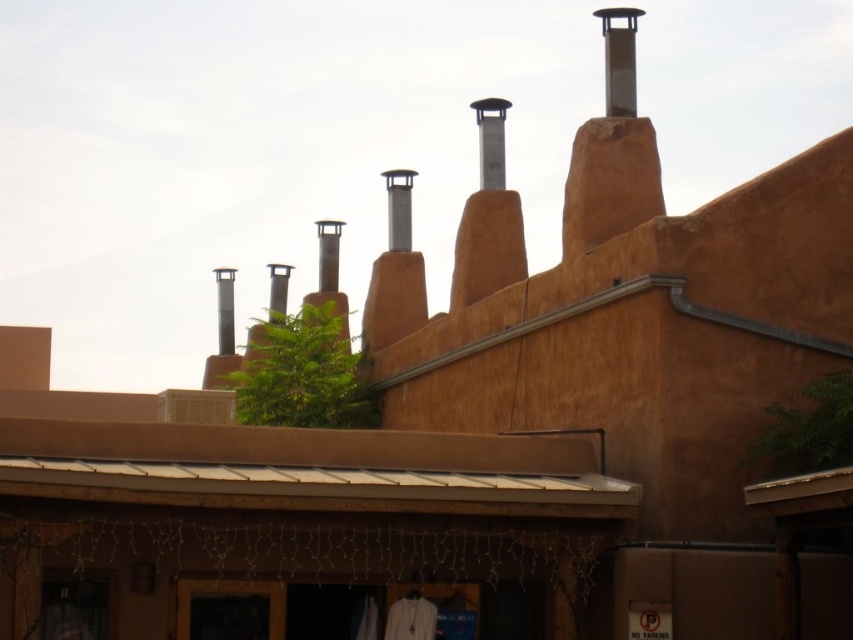
You are an architect examining the building facade. You notice a point at coordinates (619,60). Which object is this point located on?

The point at coordinates (619,60) is located on the smooth silver chimney at upper right.

You are an architect examining the building from the front. You notice two chimneys on the roofline. Which of the two chimneys, the smooth silver chimney at upper right or the satin silver chimney at upper center, is positioned to the right of the other?

The smooth silver chimney at upper right is positioned to the right of the satin silver chimney at upper center.